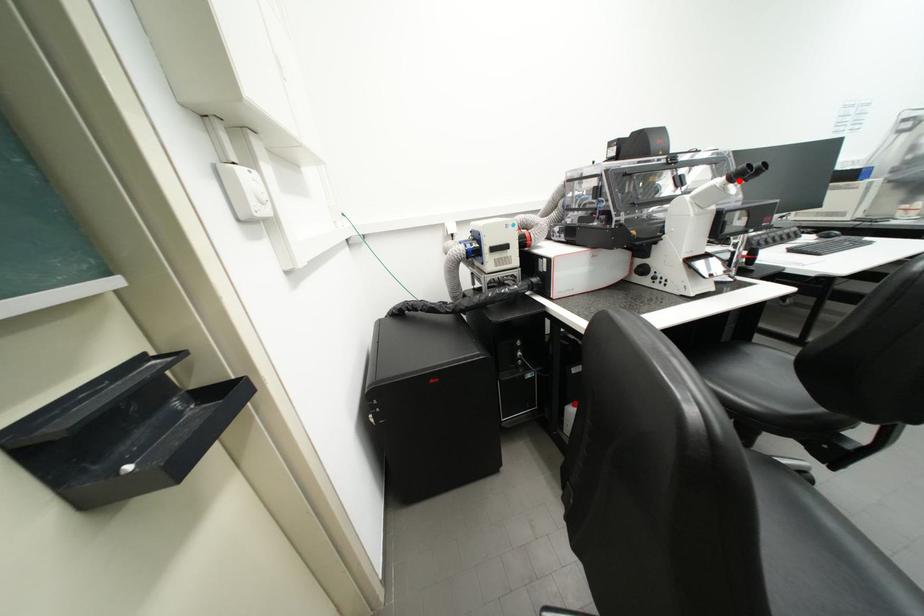
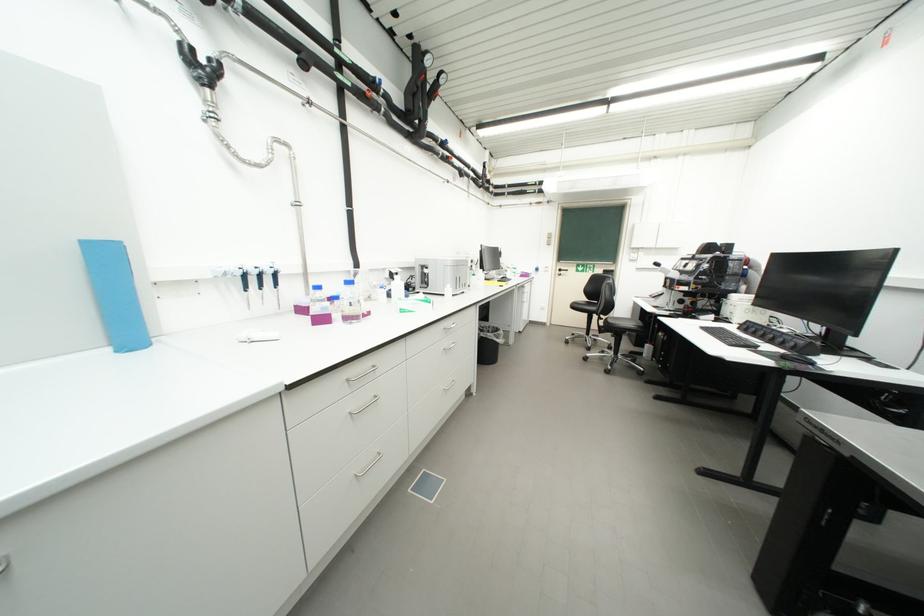
Question: I am providing you with two images of the same scene from different viewpoints. A red point is marked on the first image. At the location where the point appears in image 1, is it still visible in image 2?

Choices:
 (A) Yes
 (B) No

Answer: (B)